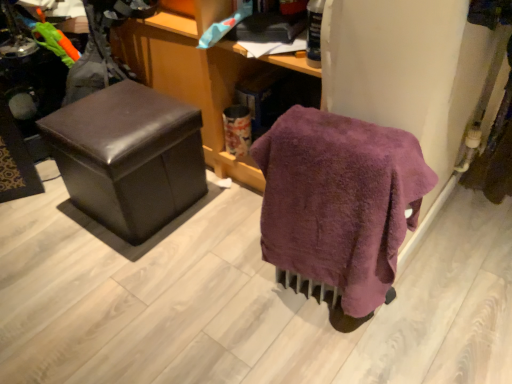
What do you see at coordinates (339, 200) in the screenshot? I see `purple terry cloth towel at lower right` at bounding box center [339, 200].

What are the coordinates of `purple terry cloth towel at lower right` in the screenshot? It's located at (339, 200).

Describe the element at coordinates (128, 157) in the screenshot. I see `matte brown ottoman at left` at that location.

At what (x,y) coordinates should I click in order to perform the action: click on matte brown ottoman at left. Please return your answer as a coordinate pair (x, y). This screenshot has width=512, height=384. Looking at the image, I should click on (128, 157).

This screenshot has width=512, height=384. In order to click on purple terry cloth towel at lower right in this screenshot , I will do `click(339, 200)`.

Which object is positioned more to the left, purple terry cloth towel at lower right or matte brown ottoman at left?

From the viewer's perspective, matte brown ottoman at left appears more on the left side.

Is purple terry cloth towel at lower right positioned before matte brown ottoman at left?

That is True.

Which is nearer, (294,245) or (182,170)?

Clearly, point (294,245) is closer to the camera than point (182,170).

From the image's perspective, which is above, purple terry cloth towel at lower right or matte brown ottoman at left?

matte brown ottoman at left appears higher in the image.

From a real-world perspective, which is physically above, purple terry cloth towel at lower right or matte brown ottoman at left?

purple terry cloth towel at lower right.

Between purple terry cloth towel at lower right and matte brown ottoman at left, which one has smaller width?

Thinner between the two is purple terry cloth towel at lower right.

In terms of height, does purple terry cloth towel at lower right look taller or shorter compared to matte brown ottoman at left?

Considering their sizes, purple terry cloth towel at lower right has more height than matte brown ottoman at left.

Between purple terry cloth towel at lower right and matte brown ottoman at left, which one has larger size?

matte brown ottoman at left is bigger.

Which is correct: purple terry cloth towel at lower right is inside matte brown ottoman at left, or outside of it?

purple terry cloth towel at lower right lies outside matte brown ottoman at left.

Is purple terry cloth towel at lower right far away from matte brown ottoman at left?

Actually, purple terry cloth towel at lower right and matte brown ottoman at left are a little close together.

Could you tell me if purple terry cloth towel at lower right is turned towards matte brown ottoman at left?

No, purple terry cloth towel at lower right is not oriented towards matte brown ottoman at left.

At what (x,y) coordinates should I click in order to perform the action: click on furniture lying above the purple terry cloth towel at lower right (from the image's perspective). Please return your answer as a coordinate pair (x, y). Looking at the image, I should click on (128, 157).

Can you confirm if matte brown ottoman at left is positioned to the left of purple terry cloth towel at lower right?

Yes, matte brown ottoman at left is to the left of purple terry cloth towel at lower right.

In the image, is matte brown ottoman at left positioned in front of or behind purple terry cloth towel at lower right?

matte brown ottoman at left is behind purple terry cloth towel at lower right.

Between point (166, 96) and point (356, 120), which one is positioned behind?

The point (166, 96) is farther from the camera.

Consider the image. From the image's perspective, is matte brown ottoman at left on purple terry cloth towel at lower right?

Yes, from the image's perspective, matte brown ottoman at left is over purple terry cloth towel at lower right.

From a real-world perspective, which object rests below the other?

In real-world perspective, matte brown ottoman at left is lower.

Which object is wider, matte brown ottoman at left or purple terry cloth towel at lower right?

matte brown ottoman at left.

In the scene shown: Between matte brown ottoman at left and purple terry cloth towel at lower right, which one has more height?

With more height is purple terry cloth towel at lower right.

Does matte brown ottoman at left have a larger size compared to purple terry cloth towel at lower right?

Correct, matte brown ottoman at left is larger in size than purple terry cloth towel at lower right.

Is matte brown ottoman at left situated inside purple terry cloth towel at lower right or outside?

matte brown ottoman at left is outside purple terry cloth towel at lower right.

Is matte brown ottoman at left far away from purple terry cloth towel at lower right?

That's not correct — matte brown ottoman at left is a little close to purple terry cloth towel at lower right.

Is matte brown ottoman at left oriented towards purple terry cloth towel at lower right?

Yes, matte brown ottoman at left is oriented towards purple terry cloth towel at lower right.

How many degrees apart are the facing directions of matte brown ottoman at left and purple terry cloth towel at lower right?

The angle between the facing direction of matte brown ottoman at left and the facing direction of purple terry cloth towel at lower right is 85.8 degrees.

The image size is (512, 384). In order to click on furniture behind the purple terry cloth towel at lower right in this screenshot , I will do 128,157.

Where is `bath towel on the right of matte brown ottoman at left`? bath towel on the right of matte brown ottoman at left is located at coordinates (339, 200).

In order to click on bath towel lying below the matte brown ottoman at left (from the image's perspective) in this screenshot , I will do `click(339, 200)`.